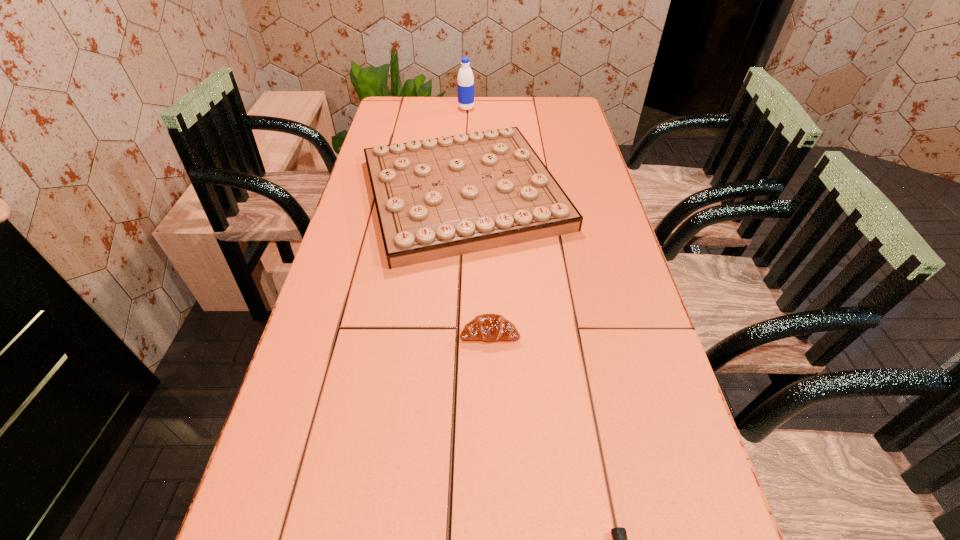
At what (x,y) coordinates should I click in order to perform the action: click on the tallest object. Please return your answer as a coordinate pair (x, y). This screenshot has height=540, width=960. Looking at the image, I should click on (465, 85).

Image resolution: width=960 pixels, height=540 pixels. Identify the location of the farthest object. (465, 85).

This screenshot has width=960, height=540. I want to click on the second tallest object, so pos(436,198).

In order to click on gameboard in this screenshot , I will do `click(436, 198)`.

The width and height of the screenshot is (960, 540). I want to click on the second shortest object, so click(489, 327).

Locate an element on the screen. This screenshot has width=960, height=540. the third farthest object is located at coordinates (489, 327).

Where is `vacant space located on the left of the tallest object`? This screenshot has width=960, height=540. vacant space located on the left of the tallest object is located at coordinates (402, 108).

This screenshot has width=960, height=540. In order to click on vacant space located on the back of the second farthest object in this screenshot , I will do `click(467, 120)`.

What are the coordinates of `free space located 0.150m on the left of the third farthest object` in the screenshot? It's located at (395, 333).

I want to click on object located at the far edge, so click(x=465, y=85).